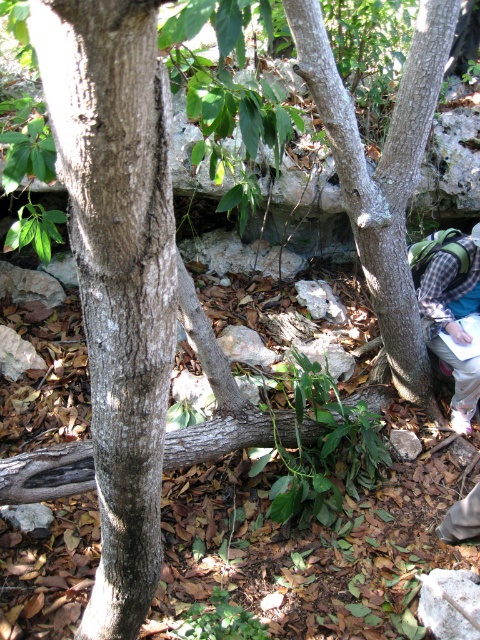
You are a gardener who needs to plant a new flower bed between the smooth bark tree at lower right and the gray rough stone at lower right. The flower bed requires a minimum distance of 3 feet between the tree and the stone. Can you plant the flower bed in this location?

The smooth bark tree at lower right is 4.20 feet from the gray rough stone at lower right. Since the required minimum distance is 3 feet, the flower bed can be planted between them as the distance is sufficient.

You are standing in the outdoor scene and want to walk from the point closer to you to the point further away. Which path should you take between the two points, point (447, 321) and point (430, 577)?

The point closer to you is point (447, 321), so you should walk towards point (430, 577) which is further away.

You are standing in the forest and see the point marked at coordinates (383, 173). Based on the scene description, what object does this point most likely represent?

The point at coordinates (383, 173) corresponds to the smooth bark tree at lower right.